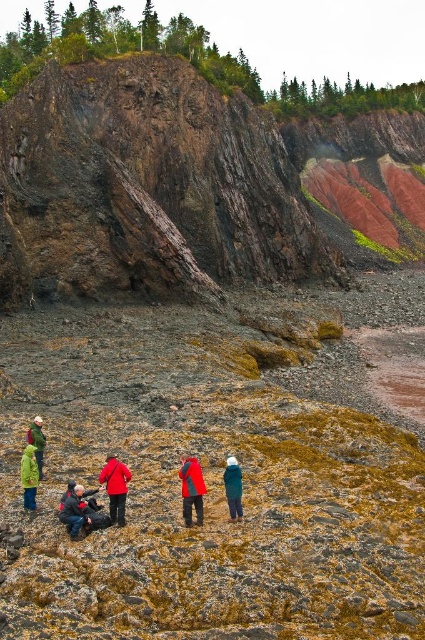
You are a hiker planning to move from the rusty rock cliff at upper left to the green fabric jacket at lower left. Given that you can only move in a straight line and your maximum safe distance for a jump is 250 feet, will you be able to make the jump?

The rusty rock cliff at upper left and green fabric jacket at lower left are 254.80 feet apart from each other. Since the distance exceeds your maximum safe jump of 250 feet, you will not be able to make the jump safely.

You are standing at the cliff edge in the rugged coastal landscape. You notice two points marked on the cliff face. The first point is at coordinates point (87, 493) and the second is at point (235, 486). Which point is closer to you?

Point (87, 493) is closer to you because it is further to the viewer than point (235, 486).

You are a hiker who wants to pass between the dark blue jacket at lower left and the green matte jacket at lower left. The path between them is narrow. If your backpack is 2 feet wide, can you fit through the space between them?

The dark blue jacket at lower left and green matte jacket at lower left are 6.58 feet apart. Since your backpack is only 2 feet wide, you have enough space to pass through the 6.58 feet gap comfortably.